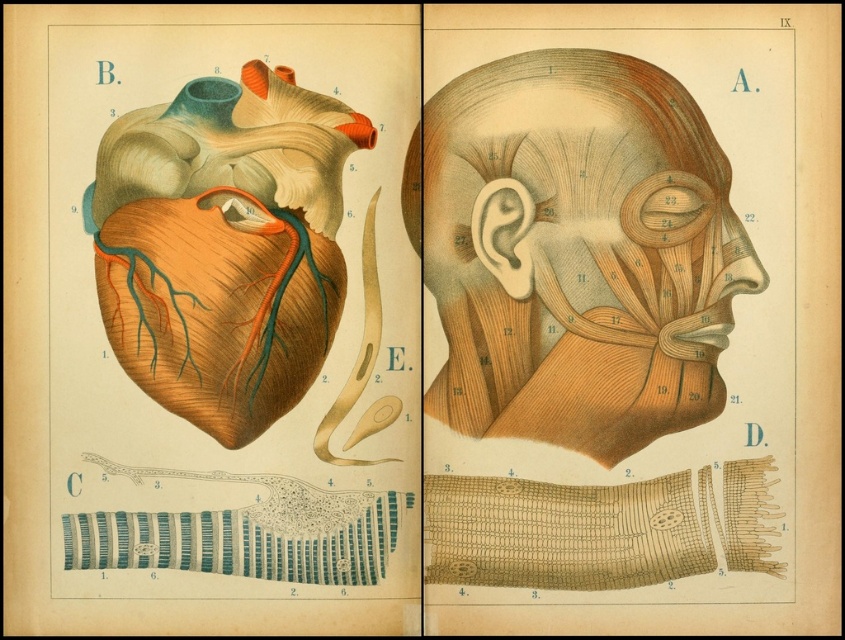
Who is positioned more to the left, brown textured skin at center or wooden neck at center?

Positioned to the left is wooden neck at center.

Who is more distant from viewer, (494, 113) or (510, 369)?

Point (510, 369)

Locate an element on the screen. brown textured skin at center is located at coordinates (578, 252).